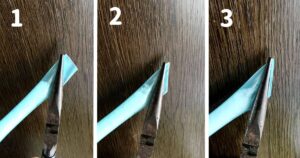
Where is `surface`? The width and height of the screenshot is (300, 158). surface is located at coordinates (58, 29).